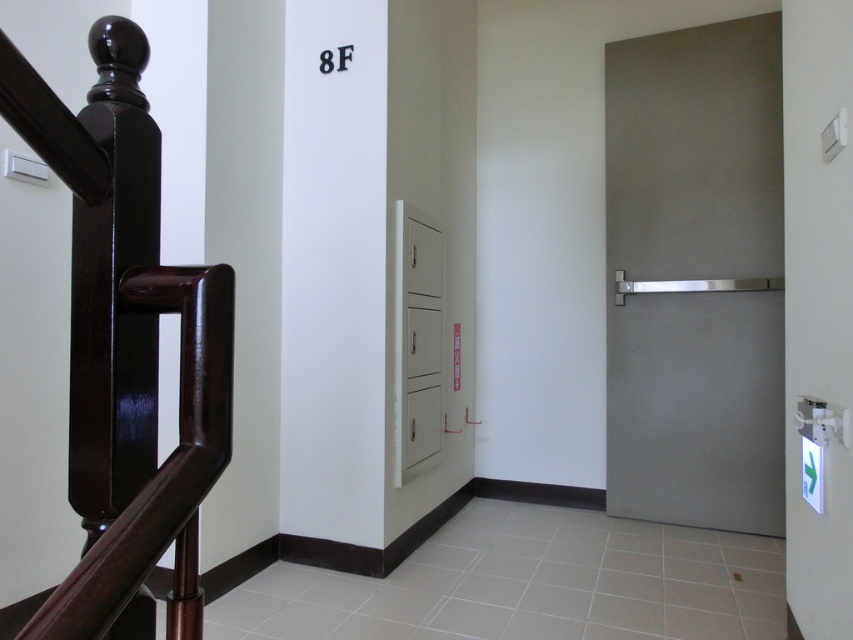
You are standing in the hallway and want to determine which point is closer to you. The points are labeled as point (735, 232) and point (412, 321). Which point is closer to your current position?

Point (412, 321) is closer to you because it is less further away than point (735, 232).

You are standing in the hallway and need to locate the emergency exit door. There is a point marked at coordinates (695, 276). Which object is this point located on?

The point marked at coordinates (695, 276) is located on the satin silver door at right.

You are a delivery person carrying a large box that is 1 meter wide. You need to pass through the hallway and go through the satin silver door at right. Can your box fit through the door if the glossy wood handrail at left is only 0.5 meters wide?

Answer: The satin silver door at right is wider than the glossy wood handrail at left. Since the door is wider than the handrail and your box is 1 meter wide, you need to compare the door width with the box width. However, the handrail is only 0.5 meters wide, but the door is wider than that. If the door is at least 1 meter wide, the box can fit. But since we don not have the exact door width, we can only say the door is wider than the handrail, which is 0.5m. Therefore, if the door is wider than 1m, it would fit.